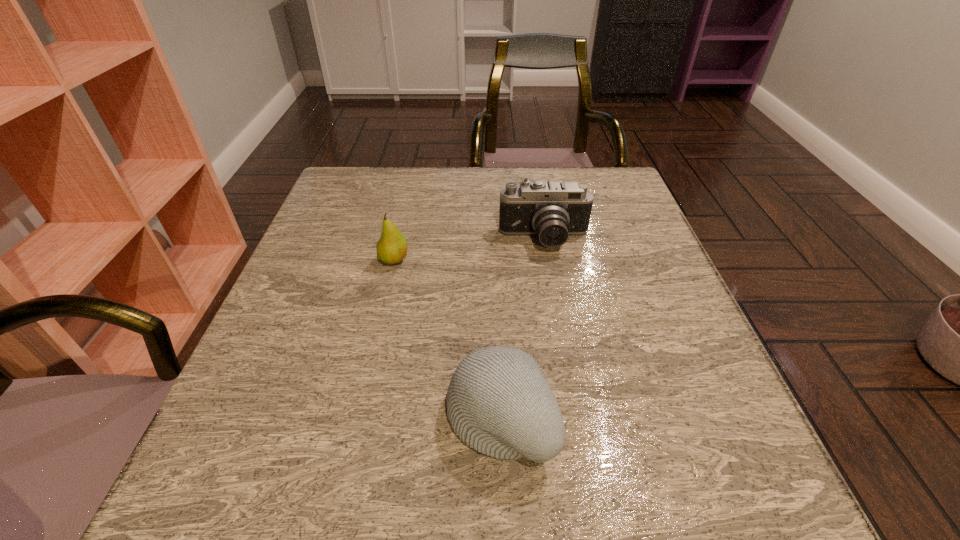
I want to click on camera, so click(552, 210).

You are a GUI agent. You are given a task and a screenshot of the screen. Output one action in this format:
    pyautogui.click(x=<x>, y=<y>)
    Task: Click on the pear
    The image size is (960, 540).
    Given the screenshot: What is the action you would take?
    pyautogui.click(x=391, y=248)

The width and height of the screenshot is (960, 540). Identify the location of the nearest object. (499, 402).

Locate an element on the screen. Image resolution: width=960 pixels, height=540 pixels. vacant space located on the front-facing side of the camera is located at coordinates (561, 328).

Image resolution: width=960 pixels, height=540 pixels. Identify the location of free space located 0.200m on the front of the leftmost object. click(x=374, y=345).

Locate an element on the screen. The width and height of the screenshot is (960, 540). free spot located 0.340m on the back of the nearest object is located at coordinates (493, 242).

The image size is (960, 540). I want to click on object that is at the near edge, so click(x=499, y=402).

The width and height of the screenshot is (960, 540). What are the coordinates of `object at the right edge` in the screenshot? It's located at (552, 210).

Where is `vacant region at the far edge of the desktop`? The image size is (960, 540). vacant region at the far edge of the desktop is located at coordinates (433, 194).

Identify the location of vacant space at the near edge. The width and height of the screenshot is (960, 540). (624, 481).